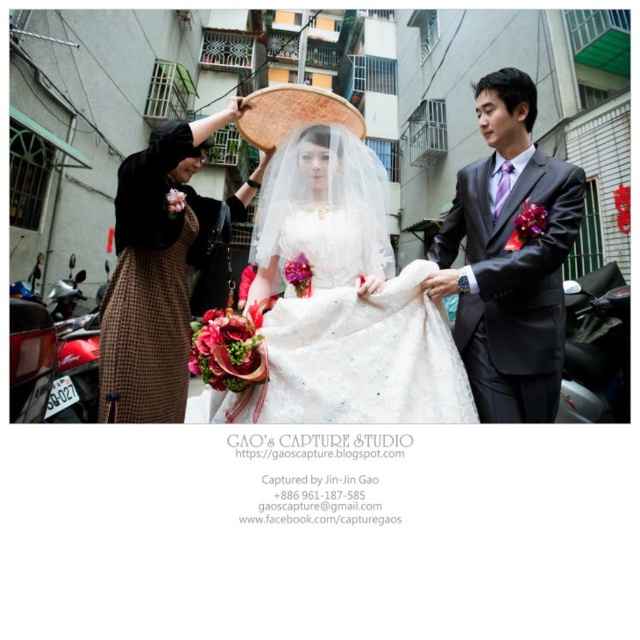
You are a photographer positioned in the alleyway where the wedding is taking place. You need to capture a photo that includes both the white lace dress at center and the shiny black suit at right. Based on their positions, which object should you adjust your camera angle to focus on first to ensure both are in frame?

The white lace dress at center is to the left of the shiny black suit at right. To capture both in the frame, start by focusing on the white lace dress at center first, then adjust the angle to include the shiny black suit at right on the right side.

In the wedding scene described, there are two guests wearing a shiny black suit at right and a brown checkered dress at left. From the bride standing in the foreground, which guest is positioned to the right side?

The shiny black suit at right is positioned to the right side of the brown checkered dress at left, so from the bride, the shiny black suit at right is on the right.

Based on the photo, you are a photographer setting up for a wedding photo shoot in a narrow alleyway between buildings. You need to position the shiny black suit at right and the white satin dress at center so that they are both visible in the frame. Given their sizes, which object should you place closer to the camera to ensure both are fully visible?

The shiny black suit at right is smaller in size compared to the white satin dress at center. To ensure both are fully visible in the frame, you should place the shiny black suit at right closer to the camera since smaller objects need to be positioned nearer to maintain their visibility alongside larger ones.